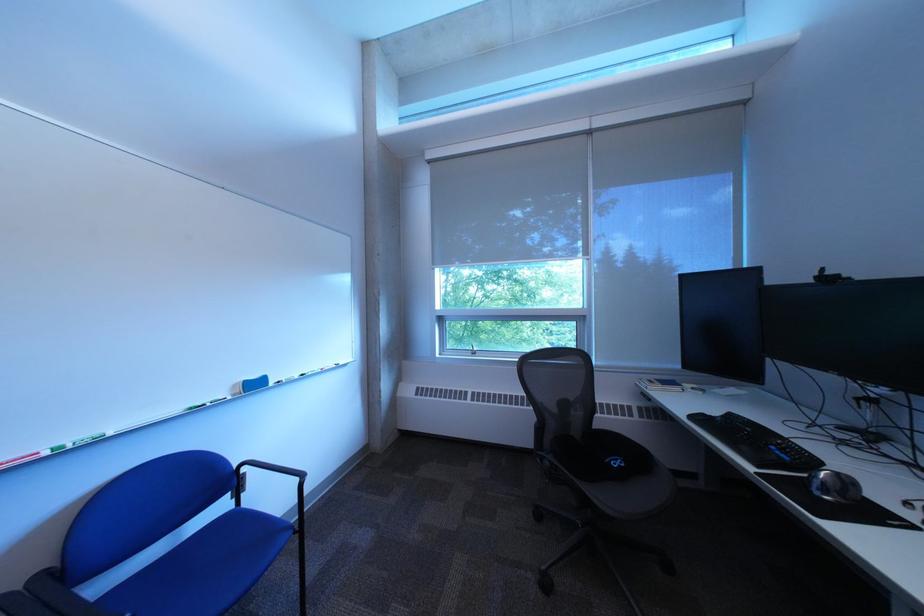
Find where to turn the window crank handle. Please return your answer as a coordinate pair (x, y).

(470, 347)